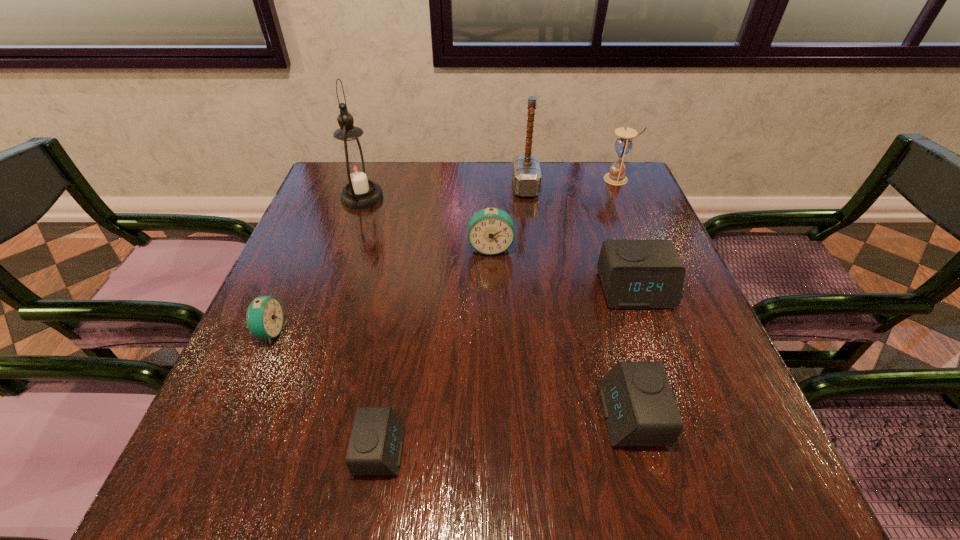
The image size is (960, 540). In order to click on oil lamp in this screenshot , I will do `click(355, 168)`.

Where is `the second object from left to right`? the second object from left to right is located at coordinates (355, 168).

Locate an element on the screen. the seventh shortest object is located at coordinates (526, 174).

This screenshot has width=960, height=540. Find the location of `brown hammer`. brown hammer is located at coordinates (526, 174).

Locate an element on the screen. This screenshot has width=960, height=540. white hourglass is located at coordinates (623, 144).

The width and height of the screenshot is (960, 540). Identify the location of hourglass. (623, 144).

Where is `the bigger blue alarm clock`? This screenshot has width=960, height=540. the bigger blue alarm clock is located at coordinates (490, 231).

The height and width of the screenshot is (540, 960). I want to click on the third alarm clock from right to left, so click(490, 231).

Locate an element on the screen. the farthest black alarm clock is located at coordinates (635, 274).

The image size is (960, 540). I want to click on the fifth farthest object, so click(x=635, y=274).